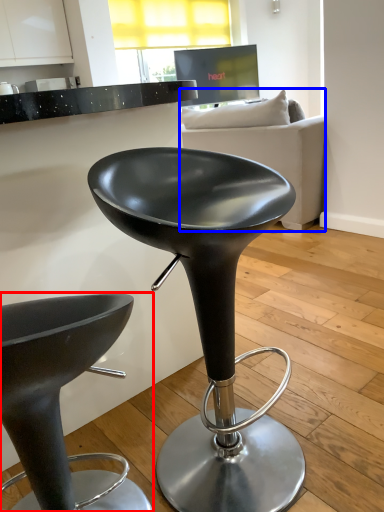
Question: Which point is further to the camera, stool (highlighted by a red box) or studio couch (highlighted by a blue box)?

Choices:
 (A) stool
 (B) studio couch

Answer: (B)